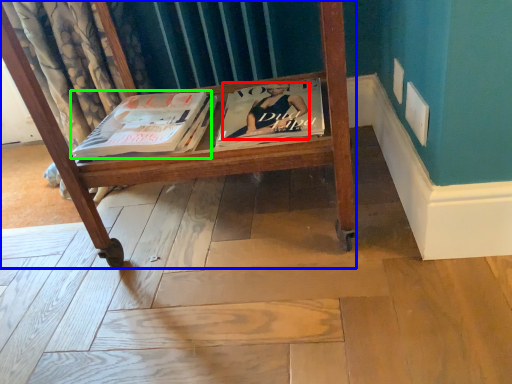
Question: Which object is positioned farthest from person (highlighted by a red box)? Select from furniture (highlighted by a blue box) and book (highlighted by a green box).

Choices:
 (A) furniture
 (B) book

Answer: (B)